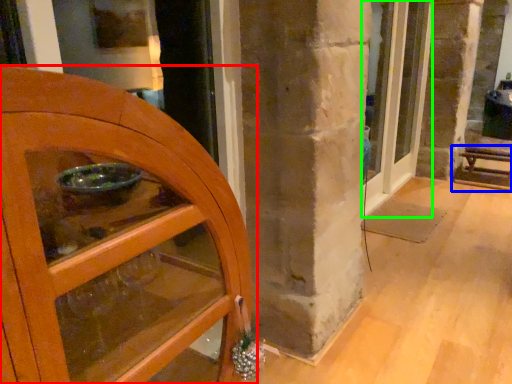
Question: Which object is the farthest from door (highlighted by a red box)? Choose among these: furniture (highlighted by a blue box) or door (highlighted by a green box).

Choices:
 (A) furniture
 (B) door

Answer: (A)